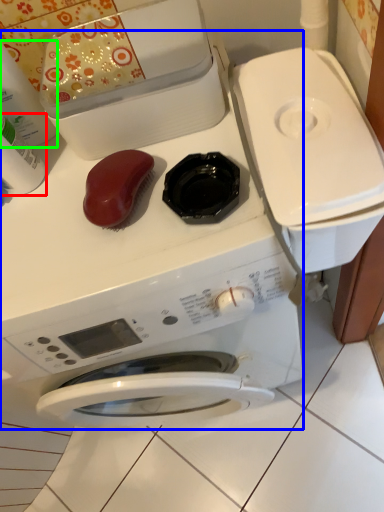
Question: Estimate the real-world distances between objects in this image. Which object is closer to cleaning product (highlighted by a red box), washing machine (highlighted by a blue box) or cleaning product (highlighted by a green box)?

Choices:
 (A) washing machine
 (B) cleaning product

Answer: (B)